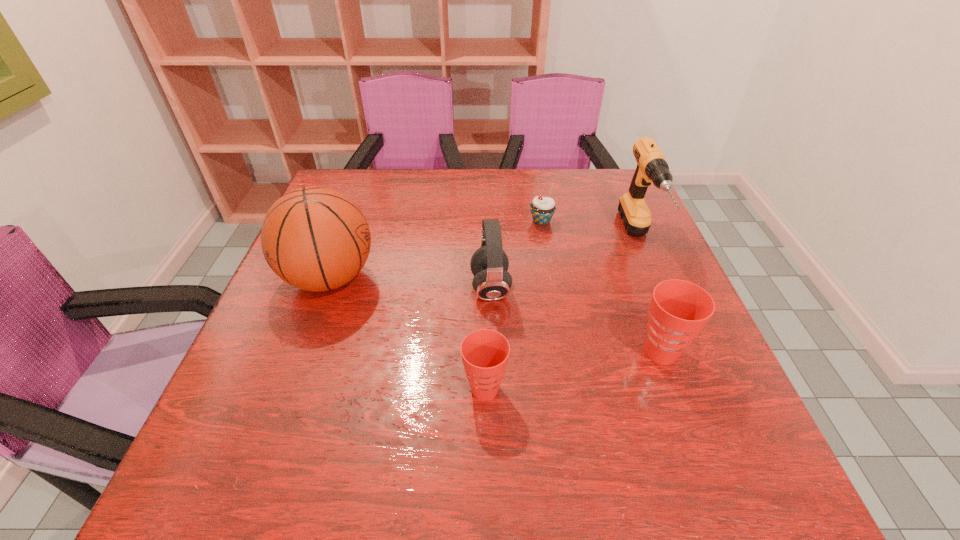
The width and height of the screenshot is (960, 540). Find the location of `free space that is in between the headset and the leftmost object`. free space that is in between the headset and the leftmost object is located at coordinates (410, 283).

I want to click on free space between the headset and the taller cup, so click(x=576, y=320).

Find the location of `free space between the drill and the headset`. free space between the drill and the headset is located at coordinates (564, 264).

Where is `vacant region between the drill and the right cup`? vacant region between the drill and the right cup is located at coordinates (650, 295).

Find the location of a particular element. Image resolution: width=960 pixels, height=540 pixels. vacant space that is in between the basketball and the cupcake is located at coordinates (x=436, y=249).

Where is `free point between the shorter cup and the basketball`? free point between the shorter cup and the basketball is located at coordinates (407, 333).

At what (x,y) coordinates should I click in order to perform the action: click on the third closest object to the headset. Please return your answer as a coordinate pair (x, y). Image resolution: width=960 pixels, height=540 pixels. Looking at the image, I should click on [x=314, y=238].

Where is `object identified as the fifth closest to the third tallest object`? The image size is (960, 540). object identified as the fifth closest to the third tallest object is located at coordinates (652, 167).

Locate an element on the screen. Image resolution: width=960 pixels, height=540 pixels. free space that satisfies the following two spatial constraints: 1. at the tip of the drill; 2. on the ear cups of the fourth shortest object is located at coordinates (660, 288).